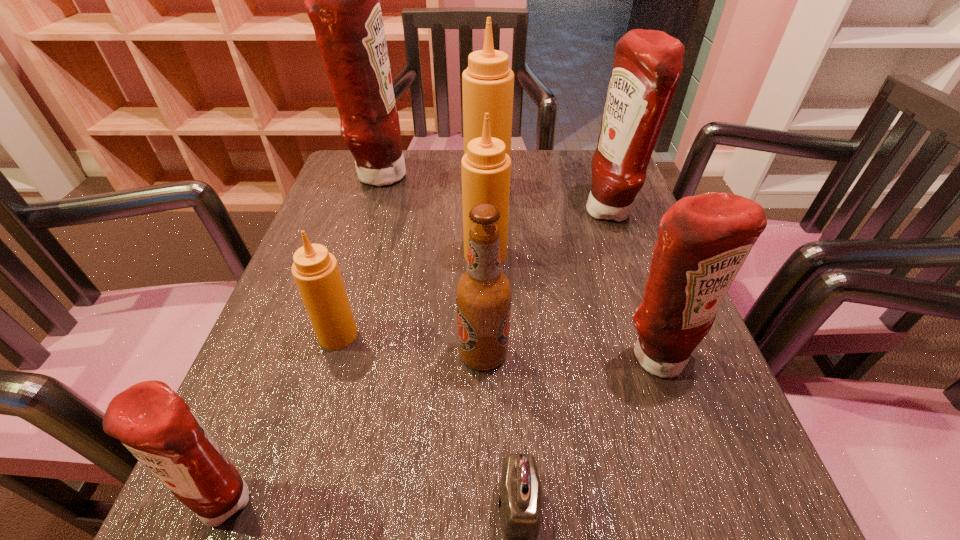
Find the location of a particular element. The height and width of the screenshot is (540, 960). vacant region that satisfies the following two spatial constraints: 1. on the back side of the second biggest red condiment; 2. on the right side of the second smallest red condiment is located at coordinates (607, 212).

You are a GUI agent. You are given a task and a screenshot of the screen. Output one action in this format:
    pyautogui.click(x=<x>, y=<y>)
    Task: Click on the free space in the image that satisfies the following two spatial constraints: 1. on the front side of the second biggest tan condiment; 2. on the front label of the beer bottle
    
    Given the screenshot: What is the action you would take?
    (487, 354)